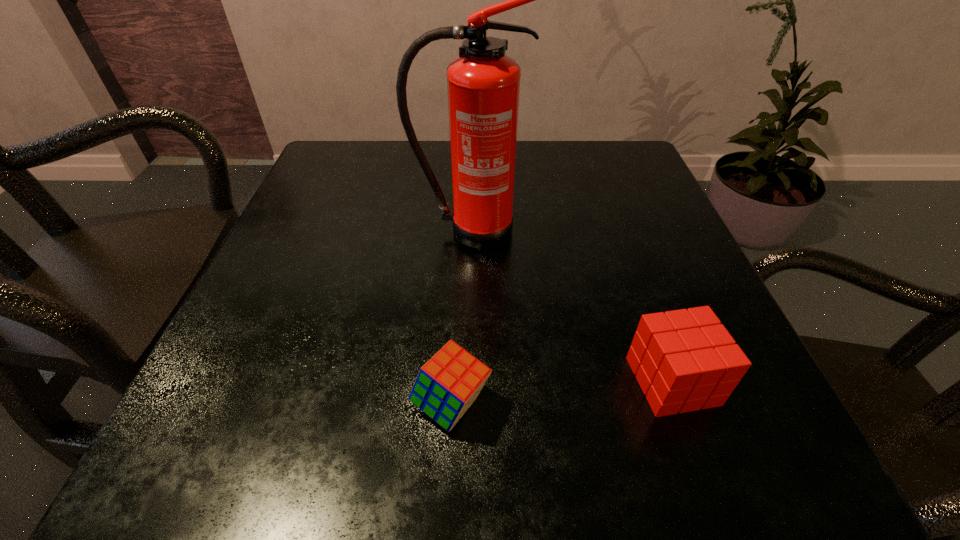
Where is `the tallest object`? the tallest object is located at coordinates (483, 84).

Where is `fire extinguisher`? The width and height of the screenshot is (960, 540). fire extinguisher is located at coordinates (483, 84).

Find the location of a particular element. This screenshot has width=960, height=540. the right cube is located at coordinates (684, 360).

You are a GUI agent. You are given a task and a screenshot of the screen. Output one action in this format:
    pyautogui.click(x=<x>, y=<y>)
    Task: Click on the left cube
    
    Given the screenshot: What is the action you would take?
    pyautogui.click(x=447, y=385)

In order to click on vacant area situated at the nozzle of the tallest object in this screenshot , I will do `click(466, 319)`.

What are the coordinates of `blank space located 0.390m on the back of the rightmost object` in the screenshot? It's located at (605, 196).

This screenshot has width=960, height=540. I want to click on free space located on the left of the left cube, so click(226, 404).

Where is `object located at the right edge`? object located at the right edge is located at coordinates (684, 360).

This screenshot has width=960, height=540. What are the coordinates of `object present at the near right corner` in the screenshot? It's located at (x=684, y=360).

Find the location of `vacant space at the far edge of the desktop`. vacant space at the far edge of the desktop is located at coordinates (523, 165).